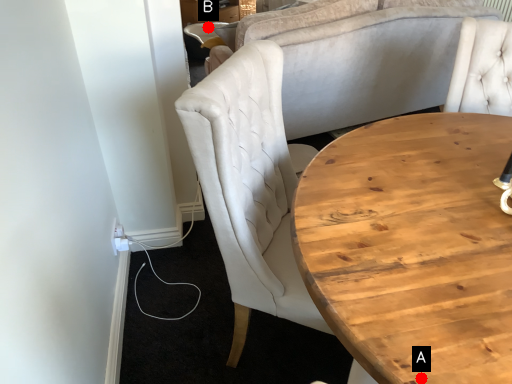
Question: Two points are circled on the image, labeled by A and B beside each circle. Which point is further to the camera?

Choices:
 (A) A is further
 (B) B is further

Answer: (B)